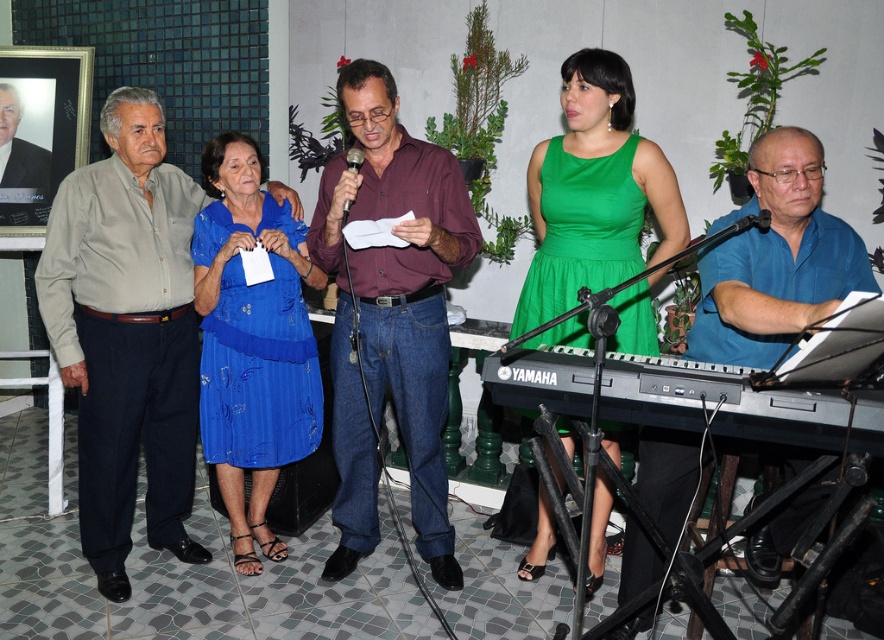
Can you confirm if blue satin dress at center is positioned to the left of green satin dress at center?

Indeed, blue satin dress at center is positioned on the left side of green satin dress at center.

Does point (211, 154) come in front of point (622, 141)?

No.

This screenshot has height=640, width=884. What are the coordinates of `blue satin dress at center` in the screenshot? It's located at (252, 342).

The width and height of the screenshot is (884, 640). What are the coordinates of `blue satin dress at center` in the screenshot? It's located at (252, 342).

Is point (104, 472) in front of point (395, 124)?

No.

Which is more to the right, light brown cotton shirt at left or maroon shirt at center?

From the viewer's perspective, maroon shirt at center appears more on the right side.

What do you see at coordinates (127, 333) in the screenshot? I see `light brown cotton shirt at left` at bounding box center [127, 333].

The height and width of the screenshot is (640, 884). Identify the location of light brown cotton shirt at left. (127, 333).

Is light brown cotton shirt at left to the right of blue satin dress at center from the viewer's perspective?

Incorrect, light brown cotton shirt at left is not on the right side of blue satin dress at center.

Image resolution: width=884 pixels, height=640 pixels. Find the location of `light brown cotton shirt at left`. light brown cotton shirt at left is located at coordinates (127, 333).

Find the location of a particular element. light brown cotton shirt at left is located at coordinates (x=127, y=333).